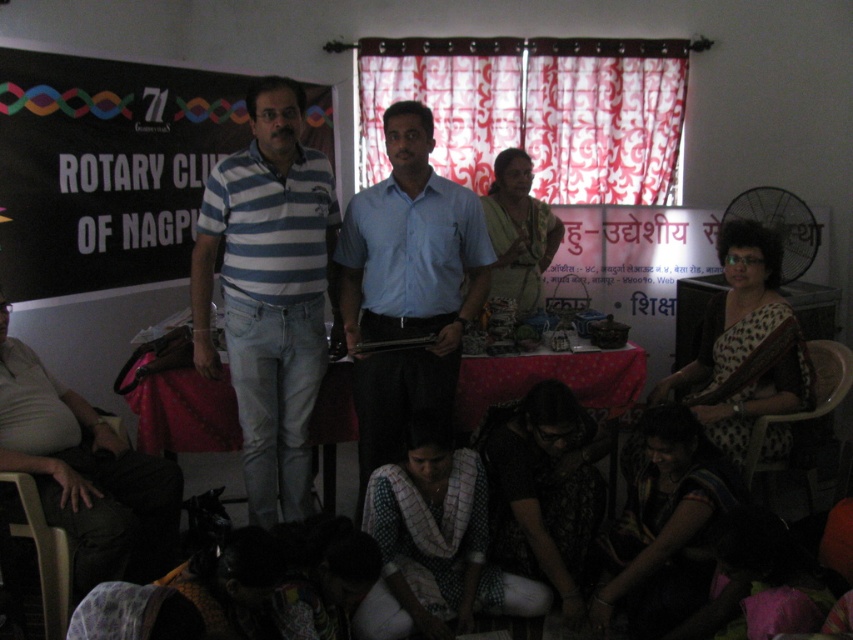
You are standing at the entrance of the room and want to move towards the point at coordinates point [498,604]. Will you pass by the point at coordinates point [167,378] first?

Yes, since point [498,604] is in front of point [167,378], you will pass by point [167,378] first on your way to point [498,604].

You are standing in the room and want to place a small plant pot on the white woven fabric at lower center. According to the coordinates provided, where exactly should you place the plant pot?

The white woven fabric at lower center is located at point (434, 545), so you should place the plant pot at those coordinates.